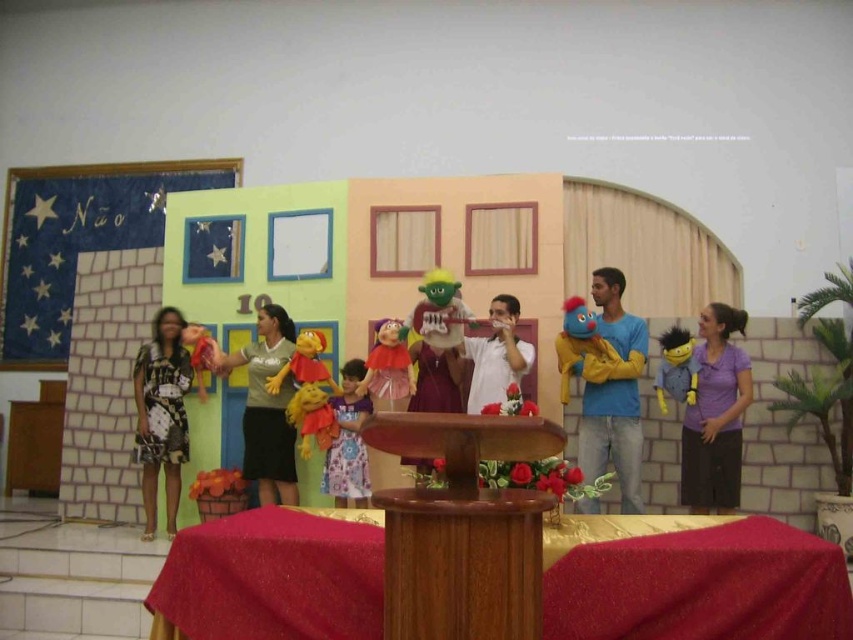
Is brown polished wood podium at center thinner than blue plush puppet at center?

Indeed, brown polished wood podium at center has a lesser width compared to blue plush puppet at center.

Does brown polished wood podium at center have a greater width compared to blue plush puppet at center?

Incorrect, brown polished wood podium at center's width does not surpass blue plush puppet at center's.

Measure the distance between brown polished wood podium at center and camera.

brown polished wood podium at center is 1.61 meters away from camera.

The height and width of the screenshot is (640, 853). Identify the location of brown polished wood podium at center. (462, 529).

Is point (705, 403) closer to camera compared to point (245, 412)?

Yes, it is.

Measure the distance from purple cotton shirt at right to matte gray shirt at center.

They are 2.77 meters apart.

Where is `purple cotton shirt at right`? The image size is (853, 640). purple cotton shirt at right is located at coordinates (715, 413).

Is white matte puppet at center shorter than green plush puppet at center?

In fact, white matte puppet at center may be taller than green plush puppet at center.

The height and width of the screenshot is (640, 853). I want to click on white matte puppet at center, so click(x=496, y=355).

Does point (469, 408) lie behind point (433, 292)?

That is True.

Image resolution: width=853 pixels, height=640 pixels. I want to click on white matte puppet at center, so click(x=496, y=355).